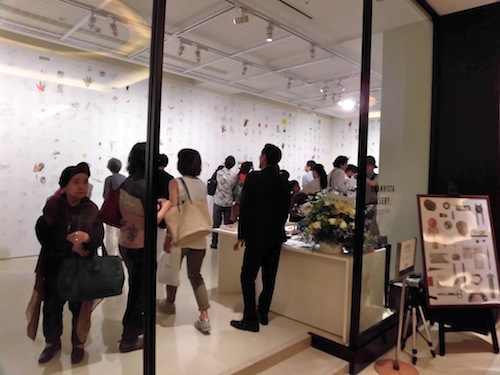
The width and height of the screenshot is (500, 375). Identify the location of display wall. (63, 111), (190, 117), (296, 118).